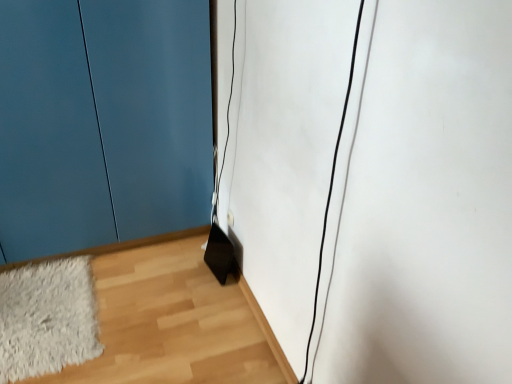
Find the location of a particular element. The width and height of the screenshot is (512, 384). empty space that is to the right of white fluffy rug at lower left is located at coordinates (144, 286).